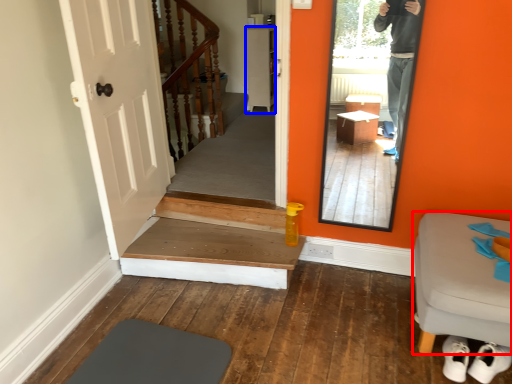
Question: Which object appears closest to the camera in this image, furniture (highlighted by a red box) or cabinetry (highlighted by a blue box)?

Choices:
 (A) furniture
 (B) cabinetry

Answer: (A)